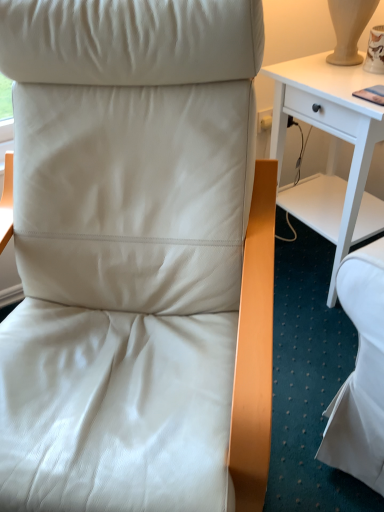
I want to click on free space above white wood desk at center (from a real-world perspective), so click(x=346, y=74).